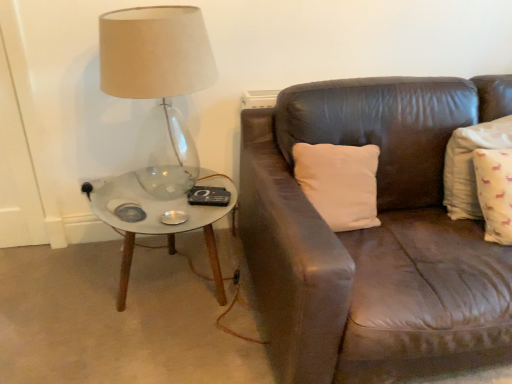
Find the location of a particular element. The image size is (512, 384). free region on the left part of white marble coffee table at left is located at coordinates (56, 288).